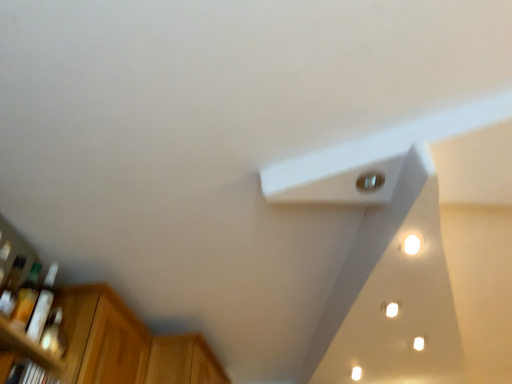
Question: Does wooden cabinet at lower left have a greater height compared to translucent glass bottle at lower left, which is the 2th bottle from back to front?

Choices:
 (A) yes
 (B) no

Answer: (B)

Question: Considering the relative sizes of wooden cabinet at lower left and translucent glass bottle at lower left, which is the 2th bottle from back to front, in the image provided, is wooden cabinet at lower left thinner than translucent glass bottle at lower left, which is the 2th bottle from back to front,?

Choices:
 (A) no
 (B) yes

Answer: (A)

Question: From a real-world perspective, is wooden cabinet at lower left over translucent glass bottle at lower left, which is the 2th bottle from back to front?

Choices:
 (A) yes
 (B) no

Answer: (A)

Question: Is translucent glass bottle at lower left, which is the 2th bottle from back to front, inside wooden cabinet at lower left?

Choices:
 (A) no
 (B) yes

Answer: (A)

Question: Is wooden cabinet at lower left facing away from translucent glass bottle at lower left, which is the 2th bottle from back to front?

Choices:
 (A) no
 (B) yes

Answer: (A)

Question: In terms of height, does translucent glass bottle at left, marked as the 1th bottle in a front-to-back arrangement, look taller or shorter compared to wooden cabinet at lower left?

Choices:
 (A) tall
 (B) short

Answer: (A)

Question: Is translucent glass bottle at left, the 3th bottle viewed from the back, to the left or to the right of wooden cabinet at lower left in the image?

Choices:
 (A) left
 (B) right

Answer: (A)

Question: From a real-world perspective, is translucent glass bottle at left, the 3th bottle viewed from the back, above or below wooden cabinet at lower left?

Choices:
 (A) above
 (B) below

Answer: (B)

Question: Which is correct: translucent glass bottle at left, marked as the 1th bottle in a front-to-back arrangement, is inside wooden cabinet at lower left, or outside of it?

Choices:
 (A) inside
 (B) outside

Answer: (B)

Question: From the image's perspective, is white glossy light at upper right, arranged as the second light when viewed from the left, located above or below white matte exhaust hood at upper center?

Choices:
 (A) above
 (B) below

Answer: (A)

Question: Is white glossy light at upper right, which is the second light from top to bottom, wider or thinner than white matte exhaust hood at upper center?

Choices:
 (A) wide
 (B) thin

Answer: (B)

Question: Considering the positions of white glossy light at upper right, arranged as the second light when viewed from the left, and white matte exhaust hood at upper center in the image, is white glossy light at upper right, arranged as the second light when viewed from the left, bigger or smaller than white matte exhaust hood at upper center?

Choices:
 (A) small
 (B) big

Answer: (A)

Question: Considering their positions, is white glossy light at upper right, arranged as the 1th light when viewed from the right, located in front of or behind white matte exhaust hood at upper center?

Choices:
 (A) front
 (B) behind

Answer: (B)

Question: Considering the positions of wooden cabinet at lower left and translucent plastic bottle at left, the 1th bottle from the back, in the image, is wooden cabinet at lower left taller or shorter than translucent plastic bottle at left, the 1th bottle from the back,?

Choices:
 (A) short
 (B) tall

Answer: (A)

Question: From a real-world perspective, relative to translucent plastic bottle at left, the 1th bottle from the back, is wooden cabinet at lower left vertically above or below?

Choices:
 (A) above
 (B) below

Answer: (A)